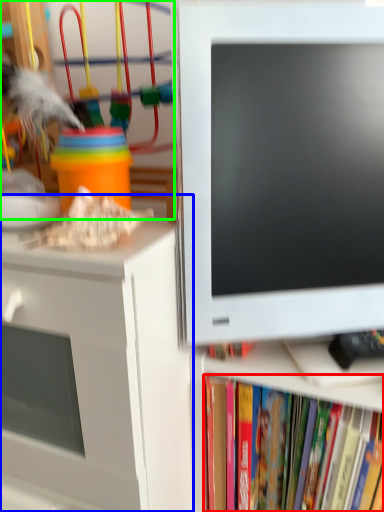
Question: Which is farther away from book (highlighted by a red box)? desk (highlighted by a blue box) or toy (highlighted by a green box)?

Choices:
 (A) desk
 (B) toy

Answer: (B)